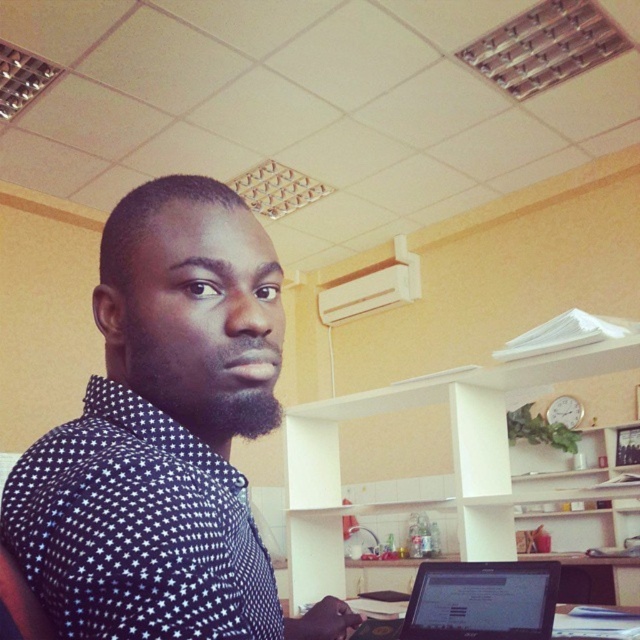
You are an office worker standing in front of the desk. You need to place a new document on the desk. Considering the black dotted shirt at upper left and the black matte laptop at lower center, which object is taller and should you avoid placing the document in front of to prevent blocking the view?

The black dotted shirt at upper left is taller than the black matte laptop at lower center. To avoid blocking the view, you should place the document away from the black dotted shirt at upper left since it is taller.

You are trying to locate the black dotted shirt at center in the image. According to the coordinates provided, where would you find it?

The black dotted shirt at center is located at point coordinates of (164, 435).

You are a photographer trying to capture a clear shot of the black dotted shirt at center and the black matte laptop at lower center. Since you want both items to appear equally sized in the photo, which object should you move closer to the camera and why?

You should move the black dotted shirt at center closer to the camera because it has a lesser width compared to the black matte laptop at lower center. By moving it closer, its apparent size in the photo will increase, making it match the size of the laptop in the frame.